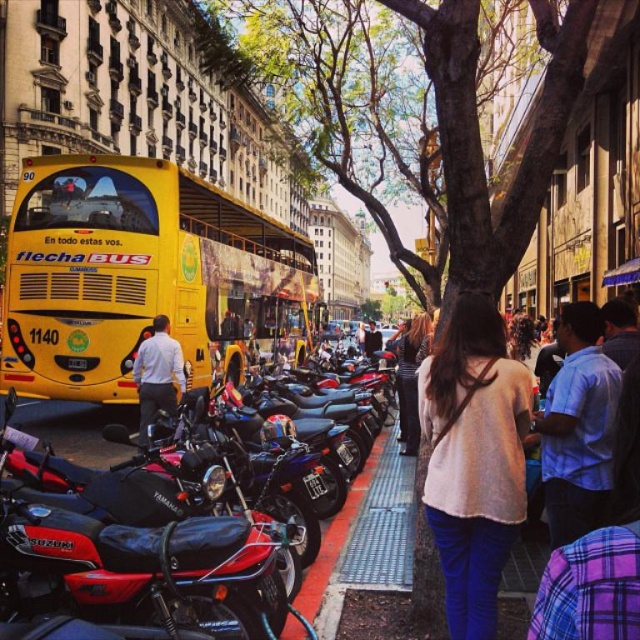
You are a pedestrian standing on the street and see the yellow matte bus at center and the shiny black dress at center. Which object is positioned to the left from your perspective?

The yellow matte bus at center is to the left of the shiny black dress at center.

You are a delivery person trying to navigate through the street. You see the yellow matte bus at center and the light beige sweater at center. Which object is wider so you can decide your path?

The yellow matte bus at center is wider than the light beige sweater at center, so you should choose a path around the bus to avoid collision.